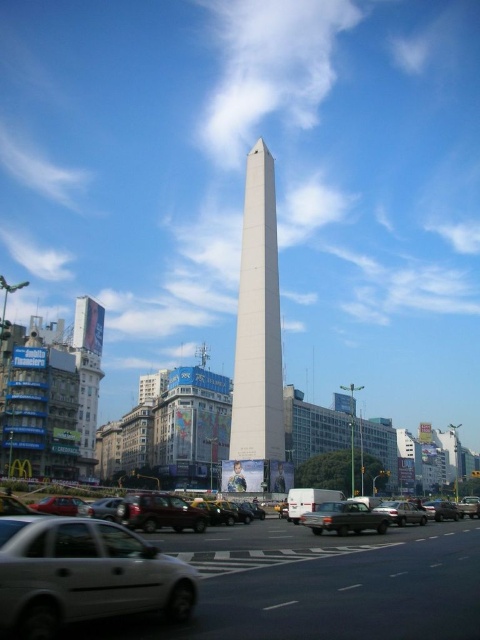
I want to click on metallic maroon sedan at center, so pos(158,513).

Looking at this image, can you confirm if metallic maroon sedan at center is smaller than metallic silver sedan at center?

Actually, metallic maroon sedan at center might be larger than metallic silver sedan at center.

The width and height of the screenshot is (480, 640). Identify the location of metallic maroon sedan at center. 158,513.

Where is `metallic maroon sedan at center`? The width and height of the screenshot is (480, 640). metallic maroon sedan at center is located at coordinates (158, 513).

Who is shorter, white matte car at center or matte gray sedan at center?

Standing shorter between the two is matte gray sedan at center.

In order to click on white matte car at center in this screenshot , I will do `click(321, 586)`.

What do you see at coordinates (321, 586) in the screenshot? The width and height of the screenshot is (480, 640). I see `white matte car at center` at bounding box center [321, 586].

You are a GUI agent. You are given a task and a screenshot of the screen. Output one action in this format:
    pyautogui.click(x=<x>, y=<y>)
    Task: Click on the white matte car at center
    This screenshot has height=640, width=480.
    Given the screenshot: What is the action you would take?
    pyautogui.click(x=321, y=586)

Can you confirm if metallic maroon sedan at center is taller than matte gray sedan at center?

Correct, metallic maroon sedan at center is much taller as matte gray sedan at center.

Is metallic maroon sedan at center thinner than matte gray sedan at center?

No.

At what (x,y) coordinates should I click in order to perform the action: click on metallic maroon sedan at center. Please return your answer as a coordinate pair (x, y). The width and height of the screenshot is (480, 640). Looking at the image, I should click on (158, 513).

Locate an element on the screen. This screenshot has height=640, width=480. metallic maroon sedan at center is located at coordinates (158, 513).